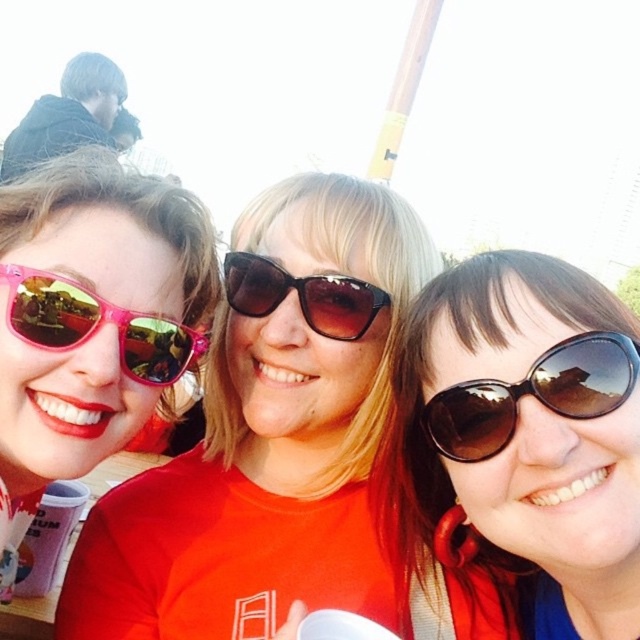
Question: From the image, what is the correct spatial relationship of brown reflective sunglasses at right in relation to pink reflective sunglasses at left?

Choices:
 (A) below
 (B) above

Answer: (A)

Question: Which of the following is the farthest from the observer?

Choices:
 (A) pink matte sunglasses at left
 (B) brown reflective sunglasses at center
 (C) brown gradient plastic sunglasses at center
 (D) brown reflective sunglasses at right

Answer: (C)

Question: Which of these objects is positioned closest to the brown reflective sunglasses at right?

Choices:
 (A) brown gradient plastic sunglasses at center
 (B) brown reflective sunglasses at center

Answer: (B)

Question: Can you confirm if pink matte sunglasses at left is positioned to the left of brown gradient plastic sunglasses at center?

Choices:
 (A) yes
 (B) no

Answer: (B)

Question: Which point is closer to the camera?

Choices:
 (A) (541, 291)
 (B) (458, 429)
 (C) (96, 321)

Answer: (A)

Question: Does brown reflective sunglasses at center have a greater width compared to pink reflective sunglasses at left?

Choices:
 (A) yes
 (B) no

Answer: (A)